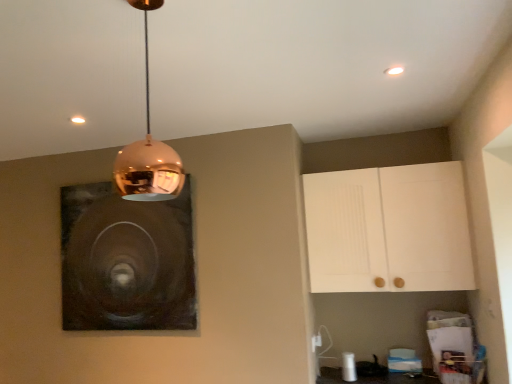
Question: Is white matte cabinet at upper right far from dark matte painting at upper left?

Choices:
 (A) no
 (B) yes

Answer: (B)

Question: Is white matte cabinet at upper right closer to camera compared to dark matte painting at upper left?

Choices:
 (A) yes
 (B) no

Answer: (A)

Question: From the image's perspective, does white matte cabinet at upper right appear lower than dark matte painting at upper left?

Choices:
 (A) no
 (B) yes

Answer: (A)

Question: Would you say dark matte painting at upper left is part of white matte cabinet at upper right's contents?

Choices:
 (A) yes
 (B) no

Answer: (B)

Question: Is white matte cabinet at upper right facing towards dark matte painting at upper left?

Choices:
 (A) yes
 (B) no

Answer: (B)

Question: From the image's perspective, is copper reflective pendant light at upper center located above or below dark matte painting at upper left?

Choices:
 (A) below
 (B) above

Answer: (B)

Question: Would you say copper reflective pendant light at upper center is to the left or to the right of dark matte painting at upper left in the picture?

Choices:
 (A) left
 (B) right

Answer: (B)

Question: Considering the positions of copper reflective pendant light at upper center and dark matte painting at upper left in the image, is copper reflective pendant light at upper center taller or shorter than dark matte painting at upper left?

Choices:
 (A) tall
 (B) short

Answer: (B)

Question: From a real-world perspective, is copper reflective pendant light at upper center positioned above or below dark matte painting at upper left?

Choices:
 (A) below
 (B) above

Answer: (B)

Question: Considering the positions of dark matte painting at upper left and copper reflective pendant light at upper center in the image, is dark matte painting at upper left bigger or smaller than copper reflective pendant light at upper center?

Choices:
 (A) small
 (B) big

Answer: (B)

Question: Is dark matte painting at upper left taller or shorter than copper reflective pendant light at upper center?

Choices:
 (A) tall
 (B) short

Answer: (A)

Question: Relative to copper reflective pendant light at upper center, is dark matte painting at upper left in front or behind?

Choices:
 (A) behind
 (B) front

Answer: (A)

Question: From the image's perspective, is dark matte painting at upper left positioned above or below copper reflective pendant light at upper center?

Choices:
 (A) above
 (B) below

Answer: (B)

Question: Choose the correct answer: Is copper reflective pendant light at upper center inside white matte cabinet at upper right or outside it?

Choices:
 (A) outside
 (B) inside

Answer: (A)

Question: Considering the positions of point (132, 144) and point (357, 175), is point (132, 144) closer or farther from the camera than point (357, 175)?

Choices:
 (A) closer
 (B) farther

Answer: (A)